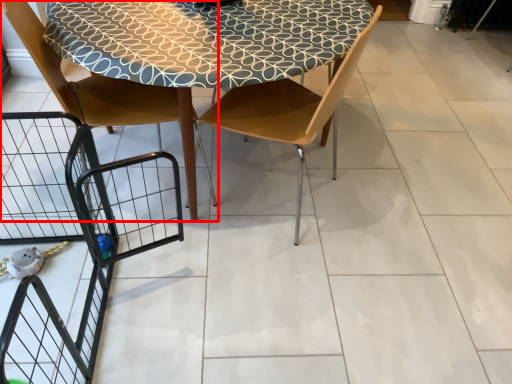
Question: From the image's perspective, where is chair (annotated by the red box) located relative to chair?

Choices:
 (A) above
 (B) below

Answer: (A)